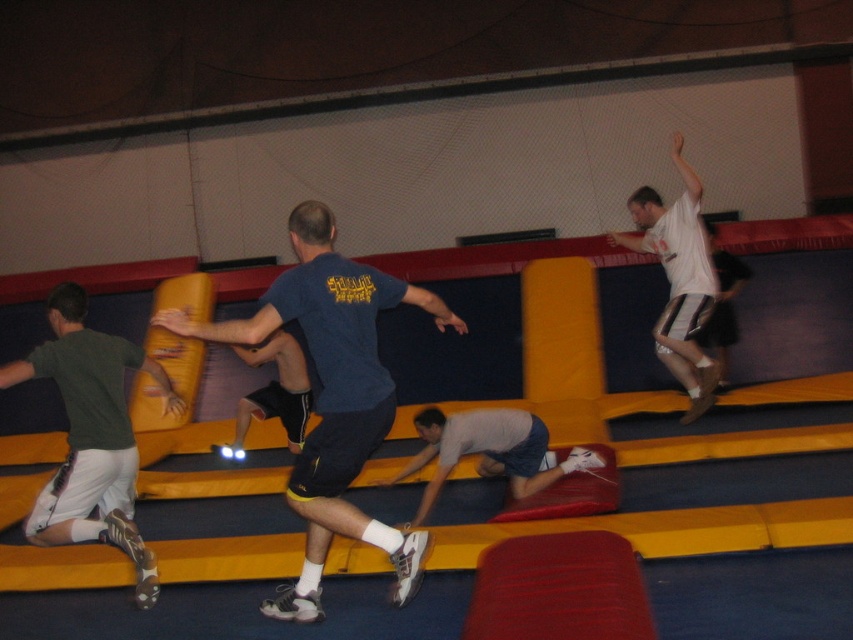
You are standing at the entrance of the trampoline park and see two points marked in the image. Which point, point (x=369, y=424) or point (x=515, y=474), is closer to you?

Point (x=369, y=424) is closer to the viewer than point (x=515, y=474).